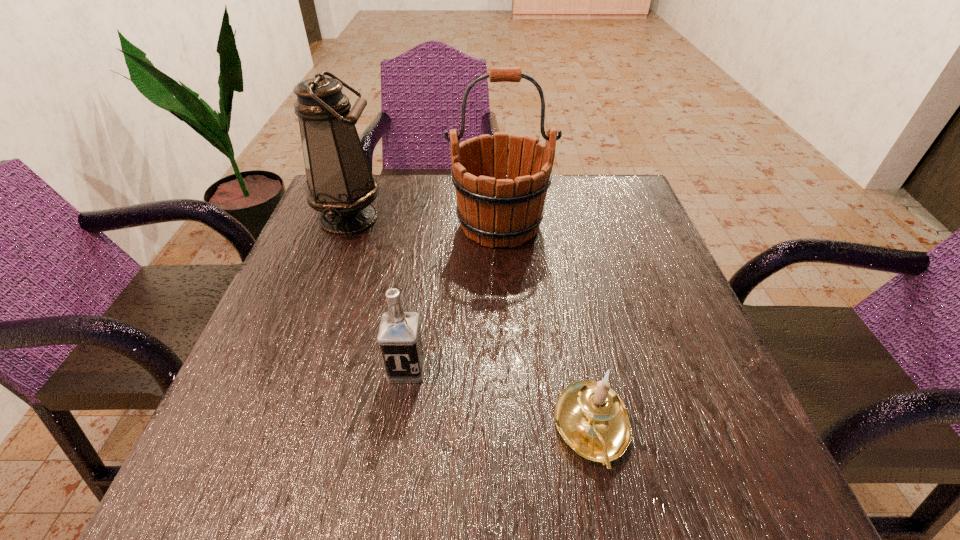
This screenshot has width=960, height=540. I want to click on object that is the third closest to the vodka, so click(340, 185).

Where is `object that is the second closest one to the third tallest object`? This screenshot has width=960, height=540. object that is the second closest one to the third tallest object is located at coordinates (500, 206).

Identify the location of vacant space that satisfies the following two spatial constraints: 1. on the front side of the wine bucket; 2. on the right side of the oil lamp. The height and width of the screenshot is (540, 960). (346, 225).